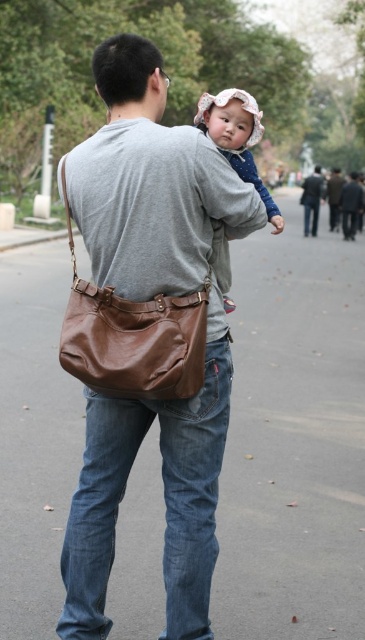
You are a photographer trying to capture the baby in the matte pink hat at upper center and the man in the dark gray leather jacket at upper center. Since both are at upper center, which one will be more visible in your photo?

The matte pink hat at upper center is in front of the dark gray leather jacket at upper center, so the matte pink hat at upper center will be more visible in the photo.

You are a photographer trying to capture a candid shot of the baby in the dark blue outfit. You notice the brown leather bag at center and the matte pink hat at upper center in your viewfinder. Which object is positioned lower in the frame?

The brown leather bag at center is located below the matte pink hat at upper center, so the brown leather bag at center is positioned lower in the frame.

You are a photographer aiming to capture the man and baby without any obstructions. Since the brown leather bag at center and dark gray jacket at center are both in the frame, which object should you adjust to ensure the man and baby are fully visible?

The brown leather bag at center is in front of the dark gray jacket at center, so adjusting the angle to move the brown leather bag at center slightly to the side would allow the dark gray jacket at center to be more visible while keeping the man and baby in focus.